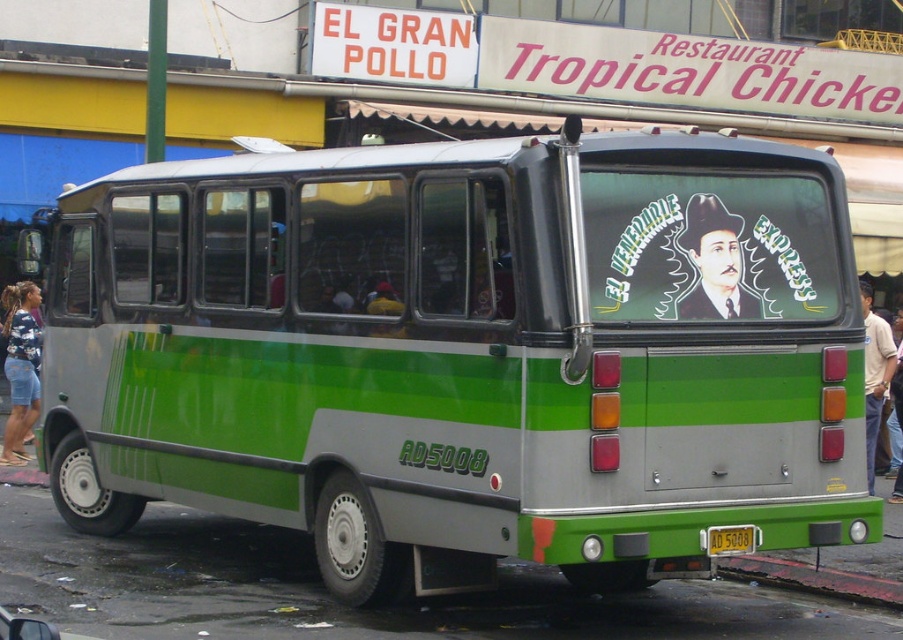
Is smooth black hat at rear center bigger than brick red sidewalk at lower right?

No, smooth black hat at rear center is not bigger than brick red sidewalk at lower right.

Is smooth black hat at rear center to the left of brick red sidewalk at lower right from the viewer's perspective?

Indeed, smooth black hat at rear center is positioned on the left side of brick red sidewalk at lower right.

Describe the element at coordinates (714, 262) in the screenshot. I see `smooth black hat at rear center` at that location.

Find the location of `smooth black hat at rear center`. smooth black hat at rear center is located at coordinates (714, 262).

Can you confirm if green matte bus at center is thinner than denim shorts at left?

Incorrect, green matte bus at center's width is not less than denim shorts at left's.

Is green matte bus at center positioned at the back of denim shorts at left?

No.

Describe the element at coordinates (461, 355) in the screenshot. I see `green matte bus at center` at that location.

This screenshot has width=903, height=640. I want to click on green matte bus at center, so click(461, 355).

How distant is green matte bus at center from yellow plastic license plate at rear?

1.82 meters

Does point (592, 420) come closer to viewer compared to point (710, 532)?

Yes, point (592, 420) is in front of point (710, 532).

Between point (513, 163) and point (732, 554), which one is positioned behind?

The point (732, 554) is more distant.

The height and width of the screenshot is (640, 903). I want to click on green matte bus at center, so click(461, 355).